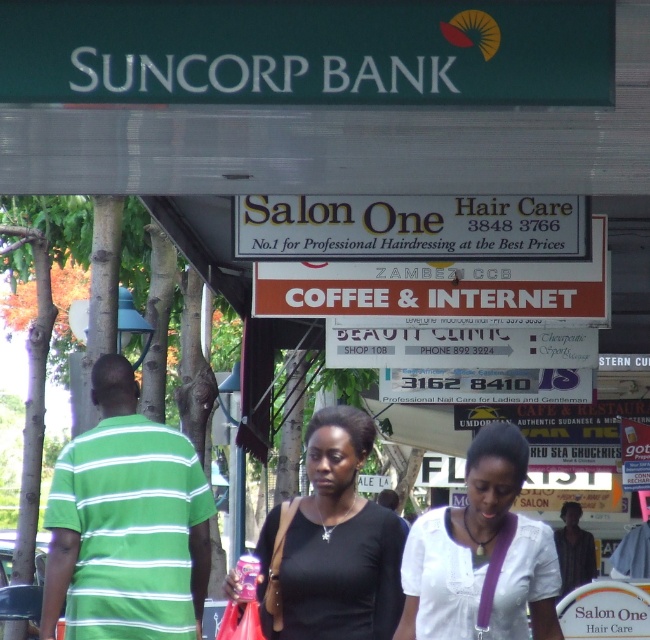
Question: Which object is positioned closest to the black matte shirt at center?

Choices:
 (A) green striped shirt at center
 (B) white matte shirt at center
 (C) dark brown leather jacket at center

Answer: (A)

Question: Among these objects, which one is farthest from the camera?

Choices:
 (A) dark brown leather jacket at center
 (B) green striped shirt at center

Answer: (A)

Question: Does black matte shirt at center appear over dark brown leather jacket at center?

Choices:
 (A) yes
 (B) no

Answer: (A)

Question: Which point is closer to the camera?

Choices:
 (A) green striped shirt at center
 (B) white matte shirt at center

Answer: (B)

Question: Where is green striped shirt at center located in relation to black matte shirt at center in the image?

Choices:
 (A) right
 (B) left

Answer: (B)

Question: Where is black matte shirt at center located in relation to white matte shirt at center in the image?

Choices:
 (A) right
 (B) left

Answer: (B)